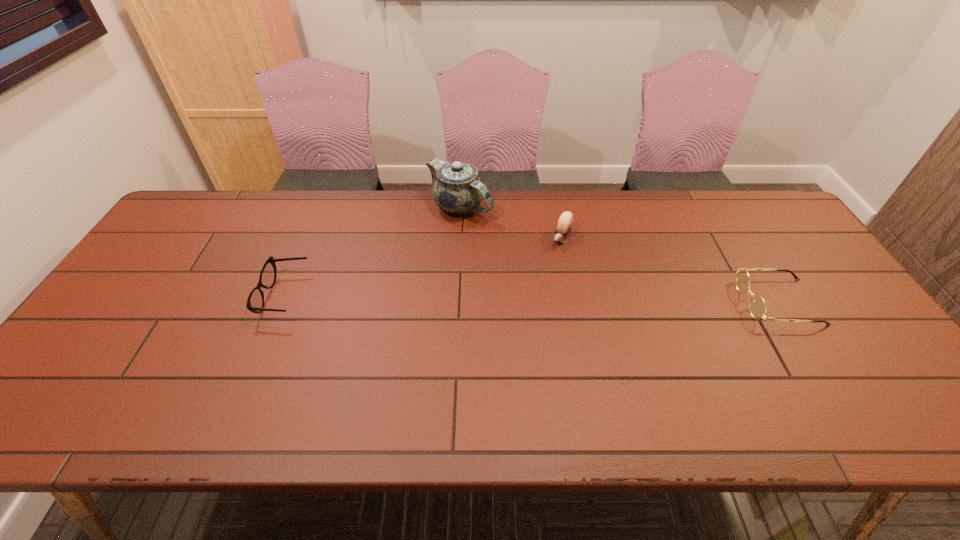
The width and height of the screenshot is (960, 540). In order to click on object that is at the right edge in this screenshot , I will do `click(757, 306)`.

Identify the location of free space at the far edge. (282, 226).

Image resolution: width=960 pixels, height=540 pixels. I want to click on free region at the near edge of the desktop, so click(x=606, y=388).

Where is `vacant space at the left edge of the desktop`? vacant space at the left edge of the desktop is located at coordinates (180, 246).

The image size is (960, 540). Find the location of `vacant area at the right edge`. vacant area at the right edge is located at coordinates (810, 293).

The height and width of the screenshot is (540, 960). Identify the location of vacant point at the far right corner. (788, 224).

I want to click on unoccupied area between the left spectacles and the tallest object, so [x=372, y=252].

You are a GUI agent. You are given a task and a screenshot of the screen. Output one action in this format:
    pyautogui.click(x=<x>, y=<y>)
    Task: Click on the empty space that is in between the third object from left to right and the leftmost object
    The width and height of the screenshot is (960, 540).
    Given the screenshot: What is the action you would take?
    pyautogui.click(x=422, y=267)

Identify the location of unoccupied area between the third nearest object and the farthest object. The width and height of the screenshot is (960, 540). (511, 222).

Find the location of `empty space between the escargot and the chinaware`. empty space between the escargot and the chinaware is located at coordinates (511, 222).